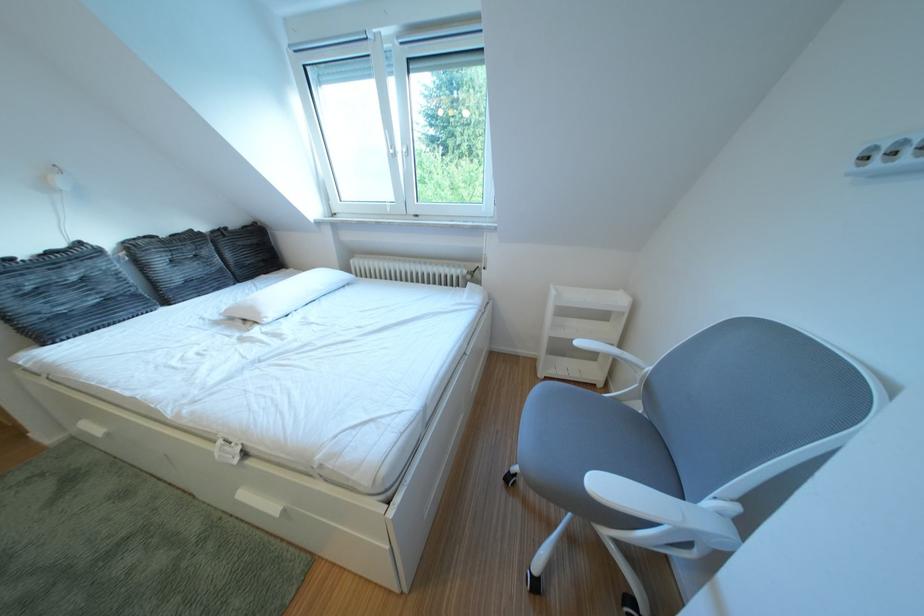
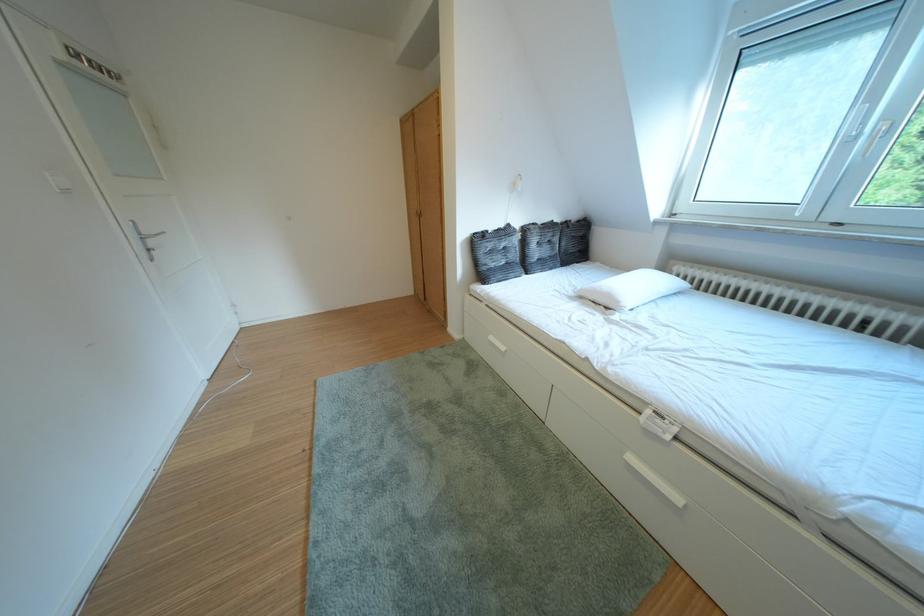
The point at (93, 249) is marked in the first image. Where is the corresponding point in the second image?

(523, 230)